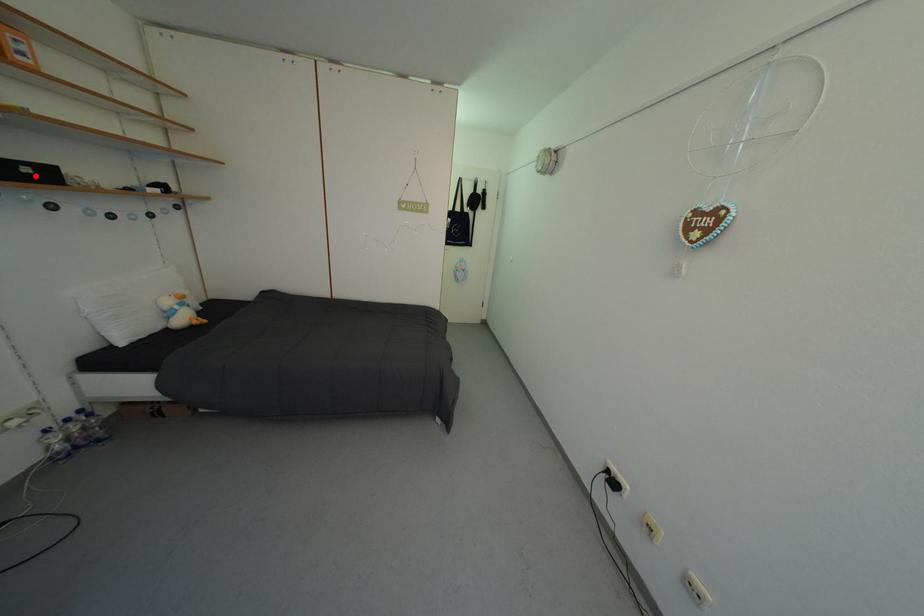
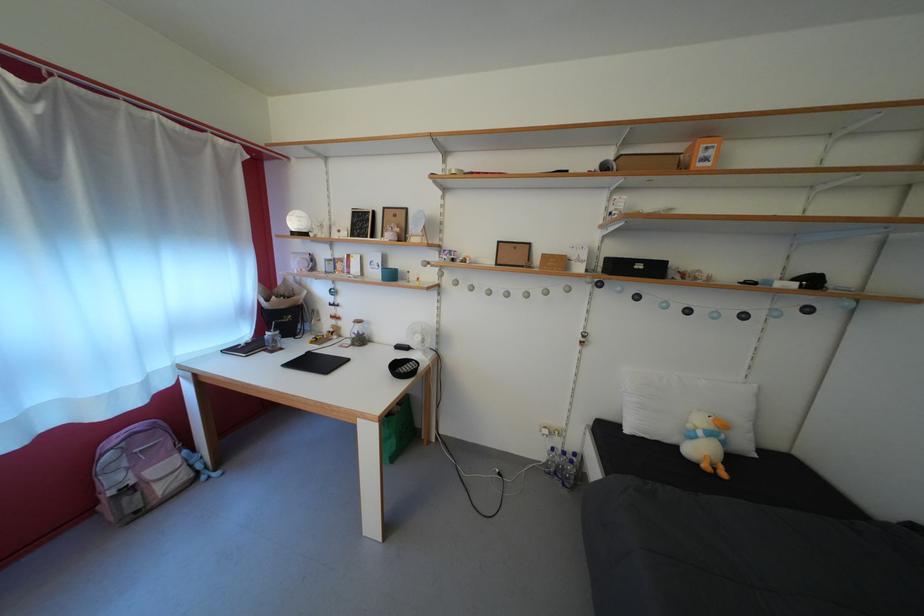
Find the pixel in the second image that matches the highlighted location in the first image.

(648, 273)